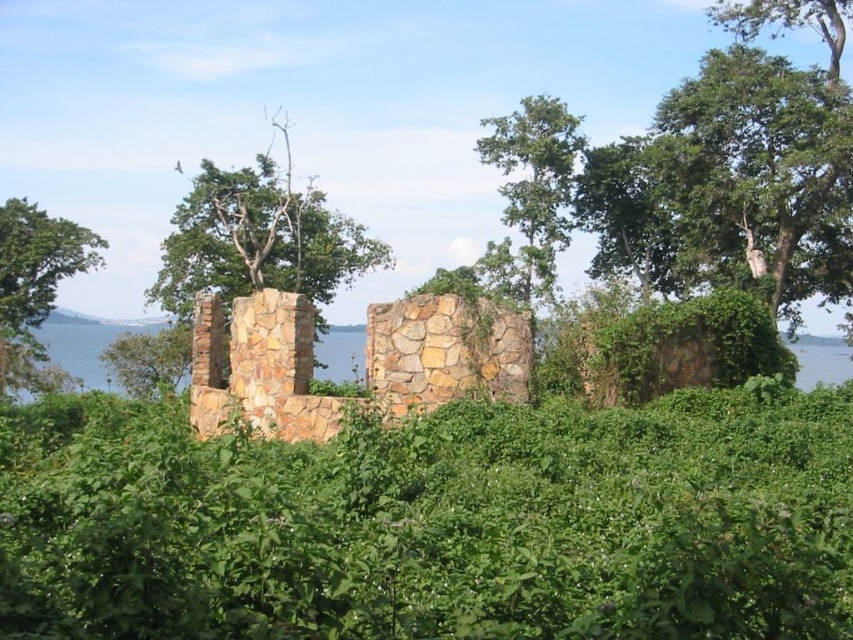
Question: Is green leafy hedge at center to the left of green leafy tree at upper right from the viewer's perspective?

Choices:
 (A) yes
 (B) no

Answer: (A)

Question: Can you confirm if green leafy hedge at center is thinner than green leafy tree at upper center?

Choices:
 (A) no
 (B) yes

Answer: (A)

Question: Can you confirm if green leafy hedge at center is bigger than green leafy tree at left?

Choices:
 (A) yes
 (B) no

Answer: (B)

Question: Which object is closer to the camera taking this photo?

Choices:
 (A) green leafy tree at upper right
 (B) green leafy tree at left

Answer: (A)

Question: Which object appears closest to the camera in this image?

Choices:
 (A) green leafy tree at upper right
 (B) green leafy tree at left
 (C) green leafy hedge at center

Answer: (C)

Question: Which point appears closest to the camera in this image?

Choices:
 (A) (509, 220)
 (B) (740, 252)
 (C) (68, 275)
 (D) (247, 561)

Answer: (D)